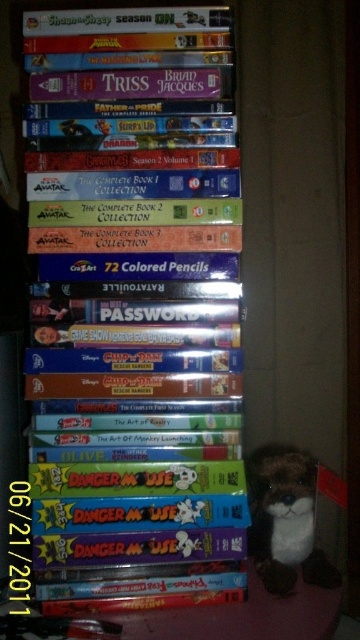
You are organizing a shelf and need to place a new item between the hardcover book at center and the brown plush toy at lower right. Where should you place it to ensure it is between them?

The hardcover book at center is located above the brown plush toy at lower right, so placing the new item between them would require positioning it either below the hardcover book at center or above the brown plush toy at lower right.

Based on the photo, you are organizing a bookshelf and need to place the hardcover book at center. According to the image, where should you position it relative to the DVDs and colored pencils?

The hardcover book at center is located at point (135, 308), so you should place it at that coordinate relative to the DVDs and colored pencils.